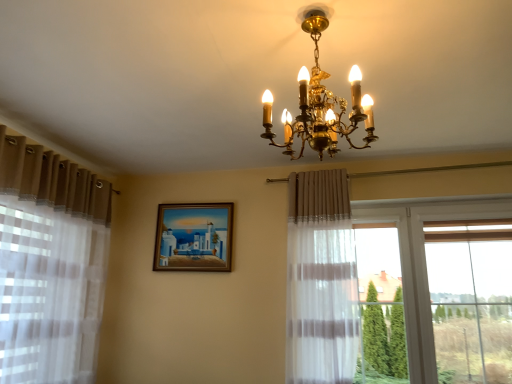
Question: From a real-world perspective, is wooden framed painting at center positioned above or below gold metallic chandelier at upper center?

Choices:
 (A) below
 (B) above

Answer: (A)

Question: Considering the positions of wooden framed painting at center and gold metallic chandelier at upper center in the image, is wooden framed painting at center wider or thinner than gold metallic chandelier at upper center?

Choices:
 (A) thin
 (B) wide

Answer: (A)

Question: Looking at the image, does wooden framed painting at center seem bigger or smaller compared to gold metallic chandelier at upper center?

Choices:
 (A) big
 (B) small

Answer: (B)

Question: From their relative heights in the image, would you say gold metallic chandelier at upper center is taller or shorter than wooden framed painting at center?

Choices:
 (A) tall
 (B) short

Answer: (A)

Question: Choose the correct answer: Is gold metallic chandelier at upper center inside wooden framed painting at center or outside it?

Choices:
 (A) inside
 (B) outside

Answer: (B)

Question: Based on their positions, is gold metallic chandelier at upper center located to the left or right of wooden framed painting at center?

Choices:
 (A) left
 (B) right

Answer: (B)

Question: From the image's perspective, is gold metallic chandelier at upper center positioned above or below wooden framed painting at center?

Choices:
 (A) below
 (B) above

Answer: (B)